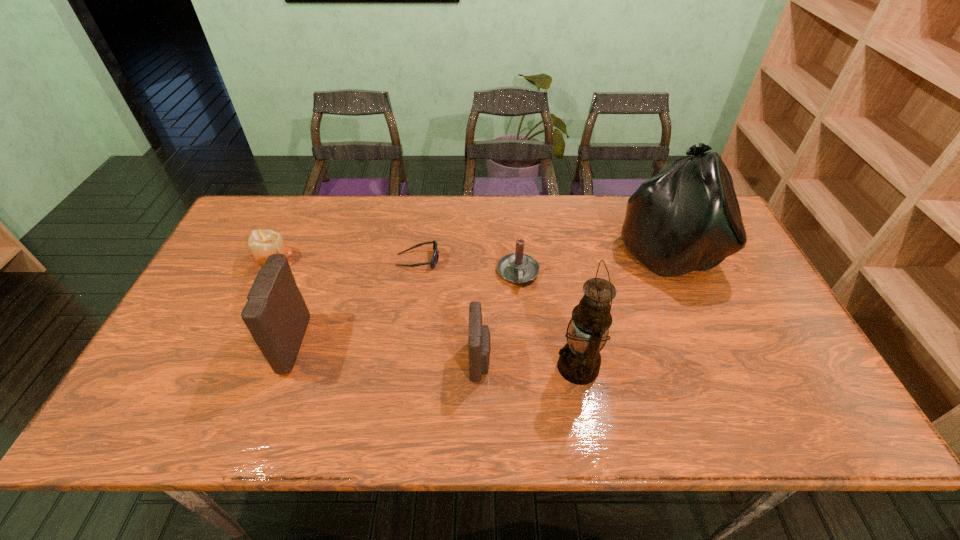
This screenshot has height=540, width=960. What are the coordinates of `vacant space that satisfies the following two spatial constraints: 1. on the front-facing side of the second object from right to left; 2. on the left side of the shortest object` in the screenshot? It's located at (403, 367).

The height and width of the screenshot is (540, 960). In order to click on vacant point that satisfies the following two spatial constraints: 1. with an open flap on the right pouch; 2. on the right side of the sixth object from left to right in this screenshot , I will do `click(480, 367)`.

This screenshot has height=540, width=960. Identify the location of free space that satisfies the following two spatial constraints: 1. on the front side of the plastic bag; 2. with an open flap on the shorter pouch. (714, 361).

The height and width of the screenshot is (540, 960). What are the coordinates of `vacant space that satisfies the following two spatial constraints: 1. on the back side of the oil lamp; 2. with an open flap on the second object from left to right` in the screenshot? It's located at (573, 344).

In order to click on vacant region that satisfies the following two spatial constraints: 1. on the back side of the plastic bag; 2. on the right side of the leftmost object in this screenshot , I will do `click(278, 251)`.